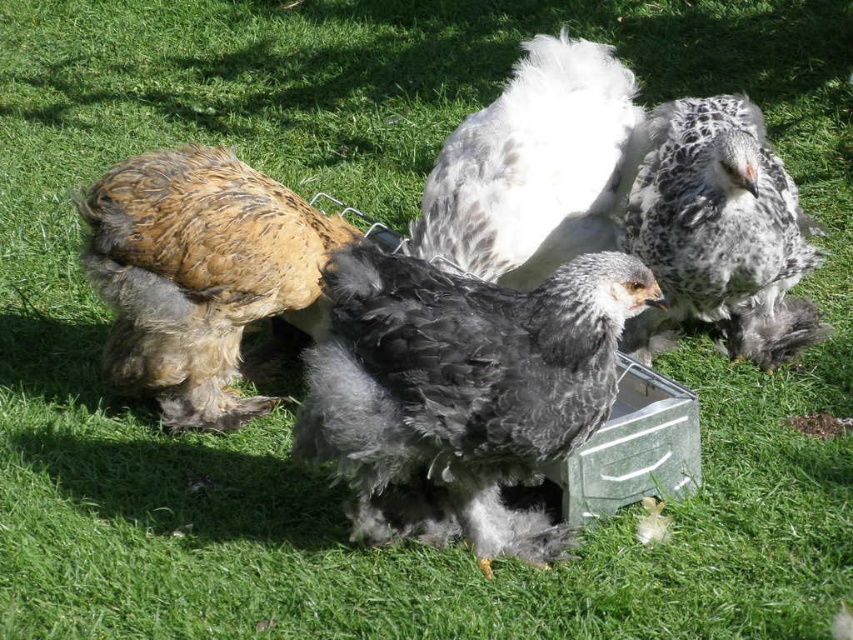
Question: Which point appears closest to the camera in this image?

Choices:
 (A) (599, 164)
 (B) (502, 321)

Answer: (B)

Question: Does silvery-gray fluffy chicken at center have a smaller size compared to white fluffy chicken at center?

Choices:
 (A) no
 (B) yes

Answer: (A)

Question: Can you confirm if silvery-gray fluffy chicken at center is wider than white fluffy chicken at center?

Choices:
 (A) no
 (B) yes

Answer: (B)

Question: Is white fluffy chicken at center to the right of speckled feathered chicken at center right from the viewer's perspective?

Choices:
 (A) no
 (B) yes

Answer: (A)

Question: Which point is farther to the camera?

Choices:
 (A) speckled feathered chicken at center right
 (B) brown fluffy chicken at left

Answer: (B)

Question: Which point is closer to the camera?

Choices:
 (A) brown fluffy chicken at left
 (B) white fluffy chicken at center
 (C) silvery-gray fluffy chicken at center
 (D) speckled feathered chicken at center right

Answer: (C)